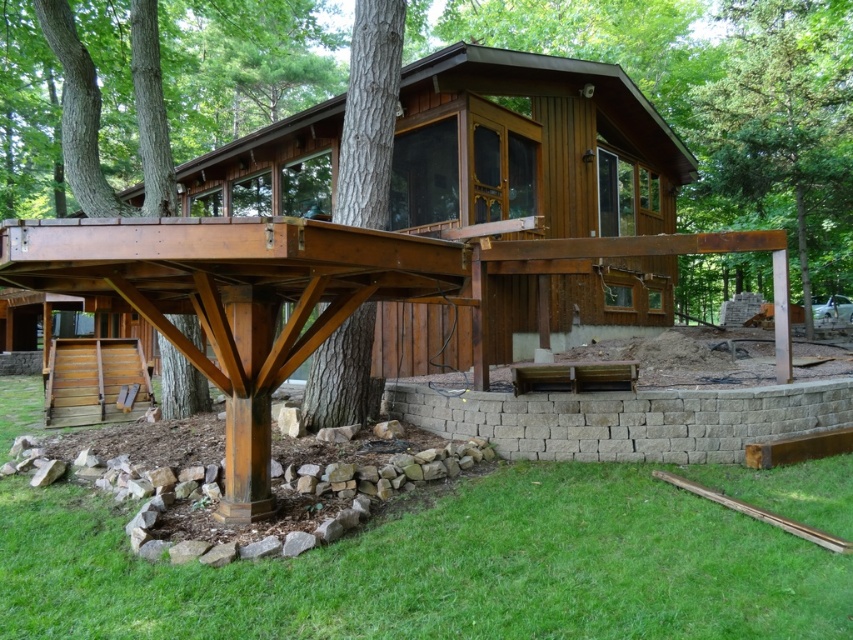
Question: Which point is closer to the camera?

Choices:
 (A) click(671, 152)
 (B) click(474, 577)

Answer: (B)

Question: Which point is closer to the camera?

Choices:
 (A) green leafy tree at upper center
 (B) brown wooden cabin at center

Answer: (B)

Question: Which of the following is the closest to the observer?

Choices:
 (A) (596, 323)
 (B) (496, 435)
 (C) (805, 566)
 (D) (363, 26)

Answer: (C)

Question: Is brown wooden cabin at center thinner than green leafy tree at upper center?

Choices:
 (A) yes
 (B) no

Answer: (B)

Question: Is brown stone wall at lower center smaller than brown rough bark tree at center?

Choices:
 (A) no
 (B) yes

Answer: (B)

Question: Does gray concrete retaining wall at lower center appear on the left side of brown rough bark tree at center?

Choices:
 (A) yes
 (B) no

Answer: (B)